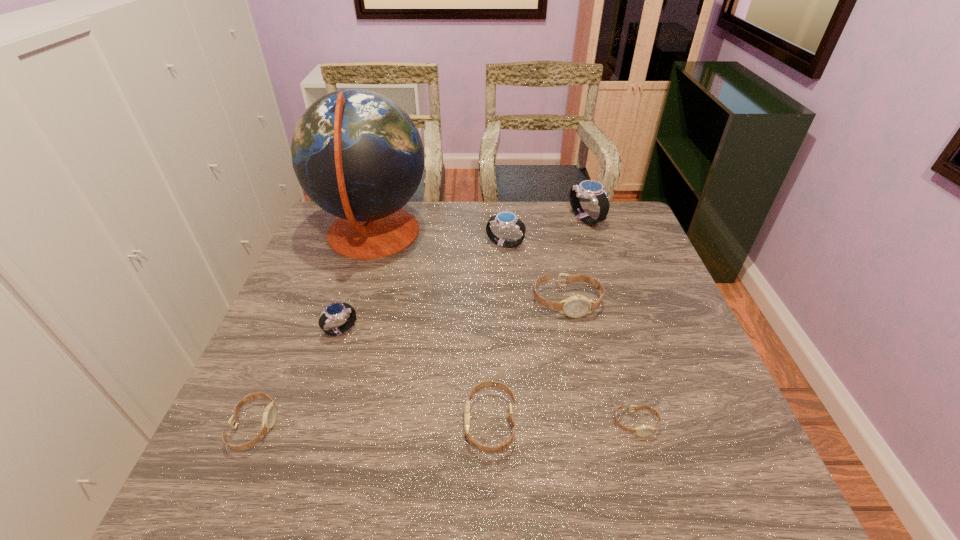
Image resolution: width=960 pixels, height=540 pixels. I want to click on free space located 0.260m on the face of the third shortest watch, so pyautogui.click(x=339, y=423).

At what (x,y) coordinates should I click in order to perform the action: click on free spot located on the face of the third shortest watch. Please return your answer as a coordinate pair (x, y). This screenshot has height=540, width=960. Looking at the image, I should click on (300, 423).

This screenshot has width=960, height=540. I want to click on free location located 0.170m on the face of the third shortest watch, so click(383, 423).

Find the location of `blank space located 0.380m on the face of the second smallest beige watch`. blank space located 0.380m on the face of the second smallest beige watch is located at coordinates (460, 427).

At what (x,y) coordinates should I click in order to perform the action: click on free space located on the face of the shortest object. Please return your answer as a coordinate pair (x, y). The height and width of the screenshot is (540, 960). Looking at the image, I should click on (650, 472).

Locate an element on the screen. The height and width of the screenshot is (540, 960). globe positioned at the far edge is located at coordinates (357, 154).

The image size is (960, 540). In order to click on globe that is positioned at the left edge in this screenshot , I will do `click(357, 154)`.

In order to click on object at the far left corner in this screenshot , I will do `click(357, 154)`.

You are a GUI agent. You are given a task and a screenshot of the screen. Output one action in this format:
    pyautogui.click(x=<x>, y=<y>)
    Task: Click on the object located at the far right corner
    The height and width of the screenshot is (540, 960).
    Given the screenshot: What is the action you would take?
    pyautogui.click(x=589, y=189)

You are a GUI agent. You are given a task and a screenshot of the screen. Output one action in this format:
    pyautogui.click(x=<x>, y=<y>)
    Task: Click on the vacant space at the far edge of the desktop
    Image resolution: width=960 pixels, height=540 pixels.
    Given the screenshot: What is the action you would take?
    pyautogui.click(x=545, y=218)